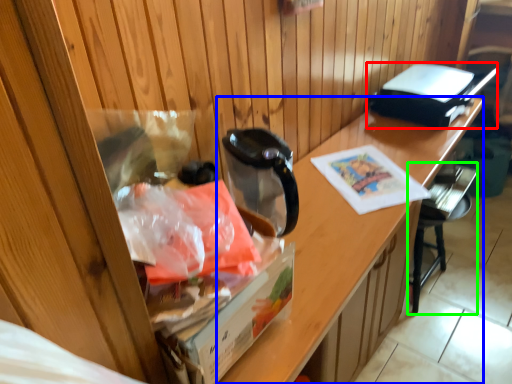
Question: Estimate the real-world distances between objects in this image. Which object is closer to appliance (highlighted by a red box), desk (highlighted by a blue box) or chair (highlighted by a green box)?

Choices:
 (A) desk
 (B) chair

Answer: (A)